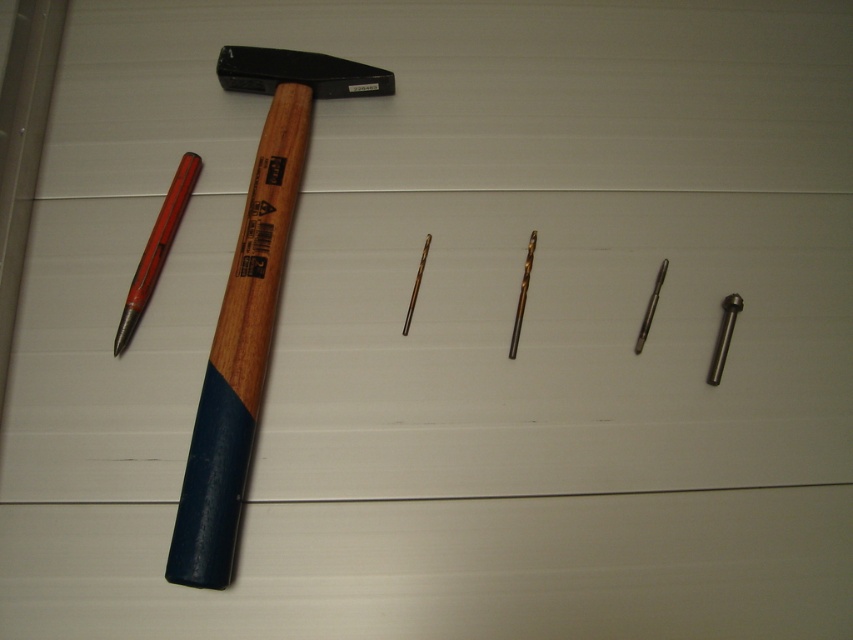
Question: Is wooden handle hammer at left to the right of red plastic pen at left from the viewer's perspective?

Choices:
 (A) yes
 (B) no

Answer: (A)

Question: Can you confirm if wooden handle hammer at left is bigger than red plastic pen at left?

Choices:
 (A) yes
 (B) no

Answer: (A)

Question: Is wooden handle hammer at left further to camera compared to red plastic pen at left?

Choices:
 (A) no
 (B) yes

Answer: (A)

Question: Which of the following is the farthest from the observer?

Choices:
 (A) (167, 192)
 (B) (247, 234)

Answer: (A)